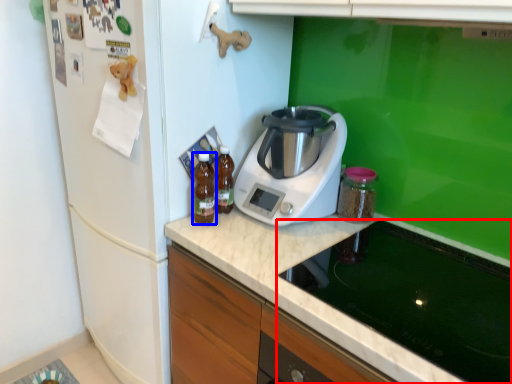
Question: Which of the following is the closest to the observer, home appliance (highlighted by a red box) or kitchen appliance (highlighted by a blue box)?

Choices:
 (A) home appliance
 (B) kitchen appliance

Answer: (A)